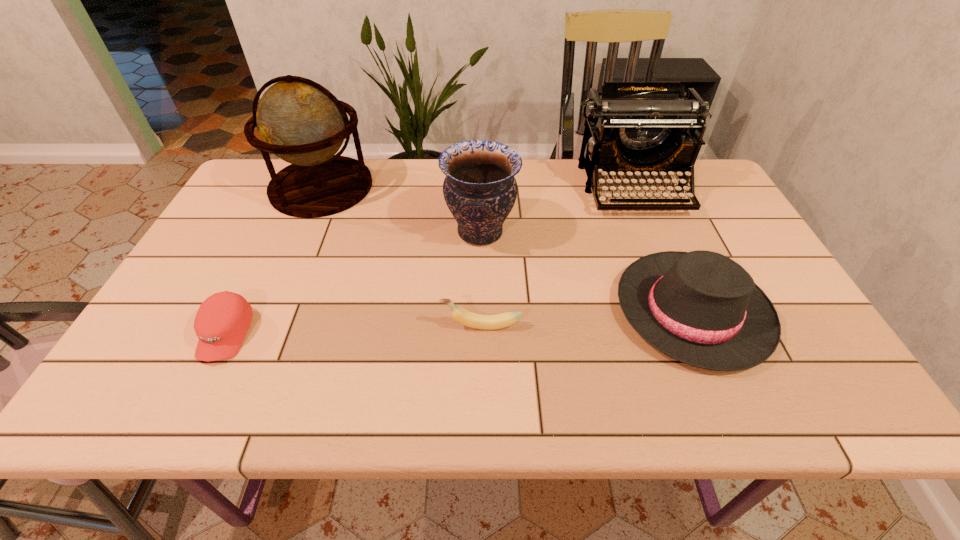
This screenshot has height=540, width=960. I want to click on globe, so click(300, 121).

You are a GUI agent. You are given a task and a screenshot of the screen. Output one action in this format:
    pyautogui.click(x=<x>, y=<y>)
    Task: Click on the typewriter
    The width and height of the screenshot is (960, 540).
    Given the screenshot: What is the action you would take?
    pyautogui.click(x=635, y=127)

Locate an element on the screen. pottery is located at coordinates click(480, 190).

Image resolution: width=960 pixels, height=540 pixels. What are the coordinates of `dress hat` in the screenshot? It's located at (701, 308).

Find the location of a particular element. The image size is (960, 540). banana is located at coordinates (487, 322).

This screenshot has width=960, height=540. In order to click on cap in this screenshot , I will do `click(221, 323)`.

Identify the location of vacant space located on the front-facing side of the globe. The width and height of the screenshot is (960, 540). (446, 187).

Locate an element on the screen. free region located 0.230m on the typing side of the typewriter is located at coordinates (670, 277).

Find the location of a particular element. blank area located 0.080m on the front handle of the pottery is located at coordinates (415, 232).

This screenshot has width=960, height=540. Find the location of `vacant area situated on the front handle of the pottery`. vacant area situated on the front handle of the pottery is located at coordinates (371, 232).